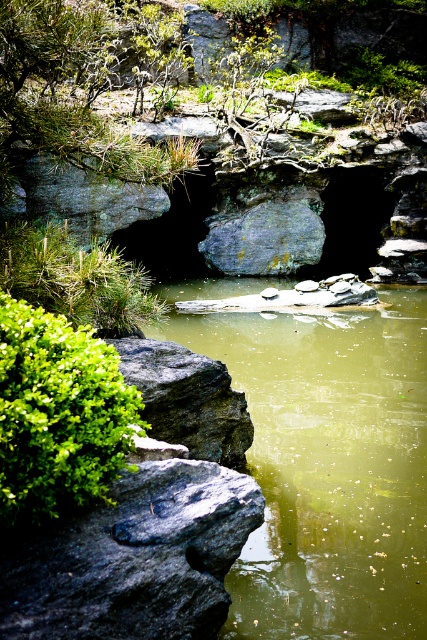
In the scene shown: You are standing in the garden scene and want to pick a leaf from the green leafy bush at lower left. To reach it, you must step over the black rough rock at lower left. Is the rock in front of or behind the bush?

The black rough rock at lower left is closer to the viewer than the green leafy bush at lower left, so the rock is in front of the bush. You would need to step over it to reach the bush.

You are a hiker who wants to place a small flag on the highest point between the gray rough rock at center and the gray rough rock at upper left. Based on the scene, which rock should you choose?

The gray rough rock at center is located above the gray rough rock at upper left, so you should place the flag on the gray rough rock at center as it is higher.

You are a hiker trying to navigate through the rocks in the garden. You see the gray rough rock at center and the gray rough rock at upper left. Which rock is closer to you?

The gray rough rock at center is closer to you because the gray rough rock at upper left is behind it.